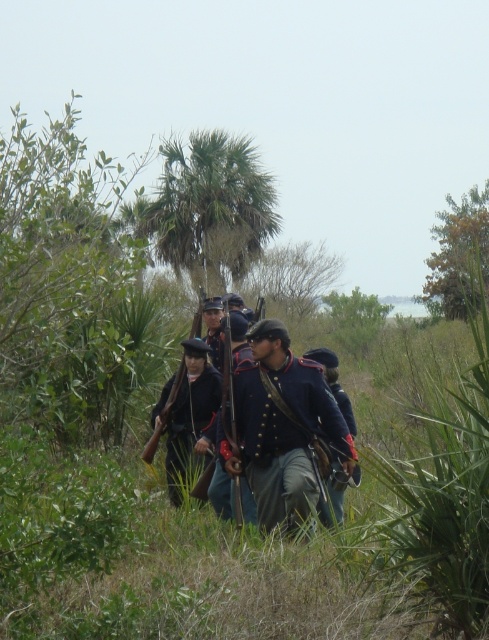
Does blue woolen coat at center have a greater height compared to dark blue wool uniform at center?

Indeed, blue woolen coat at center has a greater height compared to dark blue wool uniform at center.

Who is shorter, blue woolen coat at center or dark blue wool uniform at center?

dark blue wool uniform at center is shorter.

Looking at this image, measure the distance between point (327, 467) and camera.

They are 7.69 meters apart.

Identify the location of blue woolen coat at center. (284, 432).

Is point (305, 506) closer to camera compared to point (324, 353)?

Yes, it is.

Measure the distance between point (290, 385) and camera.

The distance of point (290, 385) from camera is 7.75 meters.

Is point (249, 406) closer to viewer compared to point (330, 493)?

Yes, it is.

The image size is (489, 640). I want to click on blue woolen coat at center, so click(x=284, y=432).

Who is higher up, blue uniformed soldiers at center or blue wool uniform at center?

blue wool uniform at center is above.

Is blue uniformed soldiers at center above blue wool uniform at center?

No, blue uniformed soldiers at center is not above blue wool uniform at center.

Is point (224, 440) positioned behind point (356, 467)?

No, it is not.

Identify the location of blue uniformed soldiers at center. Image resolution: width=489 pixels, height=640 pixels. (283, 424).